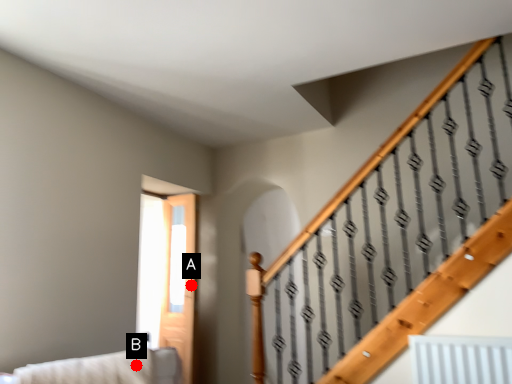
Question: Two points are circled on the image, labeled by A and B beside each circle. Which point is closer to the camera?

Choices:
 (A) A is closer
 (B) B is closer

Answer: (B)